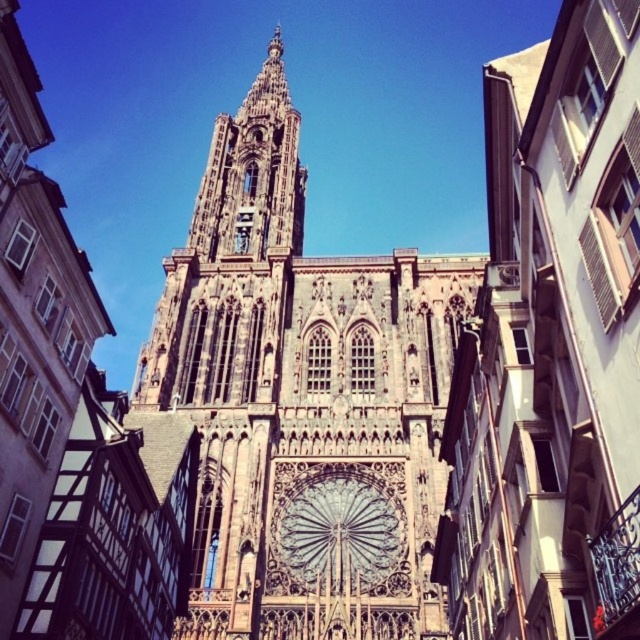
You are standing on the street in front of the cathedral. There is a point marked at coordinates (x=304, y=400). Which part of the cathedral does this point indicate?

The point at coordinates (x=304, y=400) indicates the location of the brown stone tower at center.

You are an architect examining the cathedral. You notice the brown stone tower at center and the brown stone rose window at center. Which one is located higher up on the building?

The brown stone tower at center is positioned over the brown stone rose window at center, meaning it is higher up on the building.

You are an architect visiting the cathedral and want to compare the two main features in front of you. Which one is bigger between the brown stone tower at center and the brown stone rose window at center?

The brown stone tower at center is larger than the brown stone rose window at center.